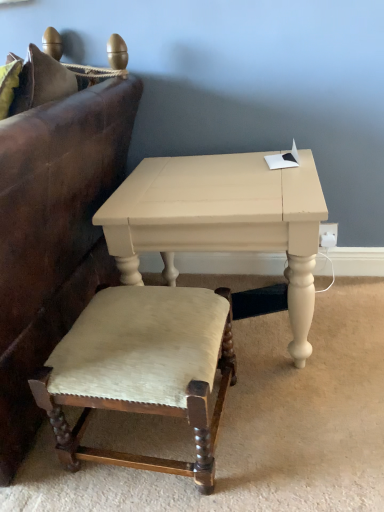
Locate an element on the screen. Image resolution: width=384 pixels, height=512 pixels. free region under matte white table at center (from a real-world perspective) is located at coordinates (258, 322).